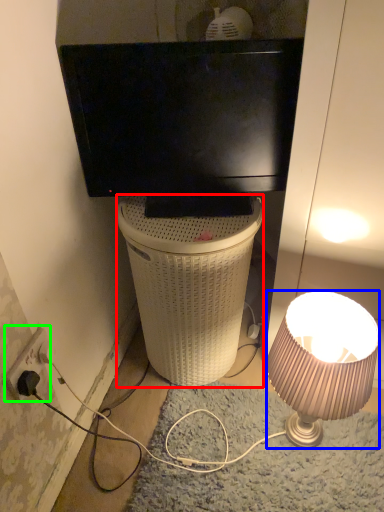
Question: Considering the real-world distances, which object is closest to trash bin/can (highlighted by a red box)? lamp (highlighted by a blue box) or power outlet (highlighted by a green box).

Choices:
 (A) lamp
 (B) power outlet

Answer: (A)